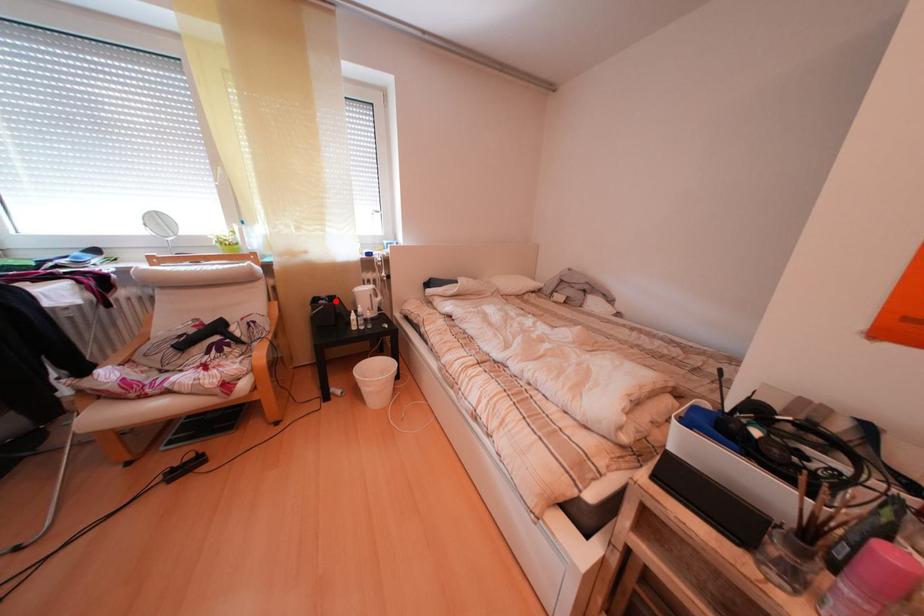
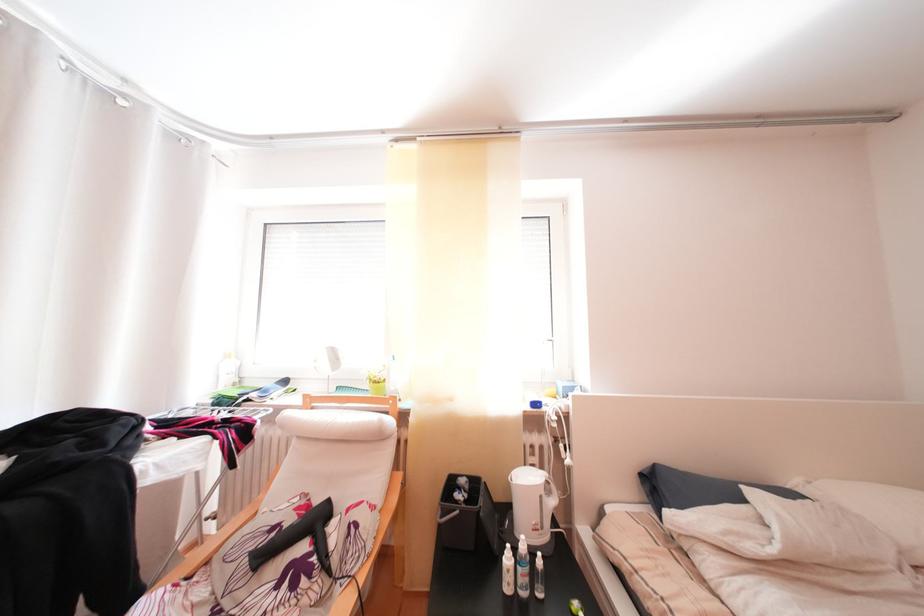
Where in the second image is the point corresponding to the highlighted location from the first image?

(475, 487)